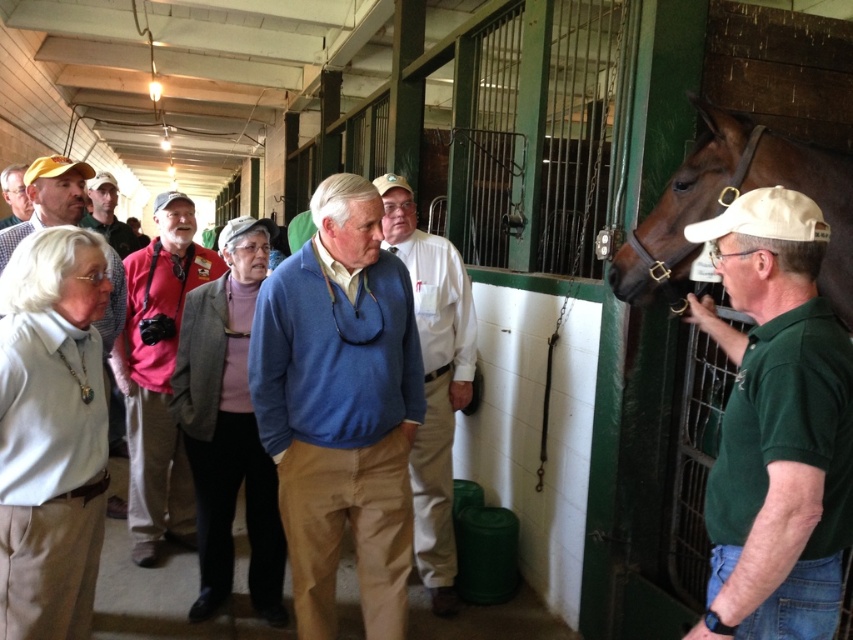
Does red shirt at center have a lesser width compared to matte pink shirt at center?

No.

Who is positioned more to the right, red shirt at center or matte pink shirt at center?

Positioned to the right is red shirt at center.

What do you see at coordinates (158, 376) in the screenshot? I see `red shirt at center` at bounding box center [158, 376].

The image size is (853, 640). I want to click on red shirt at center, so point(158,376).

Find the location of a particular element. This screenshot has height=640, width=853. white matte shirt at center is located at coordinates (51, 433).

Who is more distant from viewer, [39,477] or [834,188]?

Point [834,188]

Identify the location of white matte shirt at center. 51,433.

Is point (766, 248) farther from viewer compared to point (12, 196)?

No, (766, 248) is closer to viewer.

The height and width of the screenshot is (640, 853). What are the coordinates of `green matte shirt at right` in the screenshot? It's located at (776, 426).